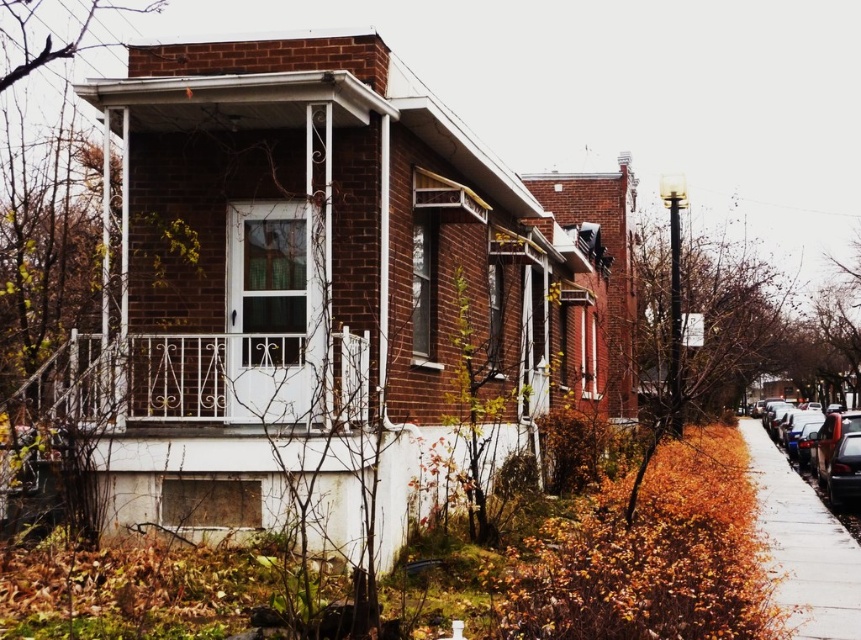
Question: Which object is positioned closest to the shiny black sedan at right?

Choices:
 (A) concrete sidewalk at lower right
 (B) white wrought iron porch at center

Answer: (A)

Question: Which of the following is the farthest from the observer?

Choices:
 (A) (819, 480)
 (B) (201, 360)
 (C) (815, 518)

Answer: (A)

Question: Which object is closer to the camera taking this photo?

Choices:
 (A) shiny black sedan at right
 (B) white wrought iron porch at center

Answer: (B)

Question: From the image, what is the correct spatial relationship of concrete sidewalk at lower right in relation to shiny black sedan at right?

Choices:
 (A) above
 (B) below

Answer: (A)

Question: Is white wrought iron porch at center bigger than shiny black sedan at right?

Choices:
 (A) yes
 (B) no

Answer: (B)

Question: Can you confirm if concrete sidewalk at lower right is smaller than shiny black sedan at right?

Choices:
 (A) yes
 (B) no

Answer: (A)